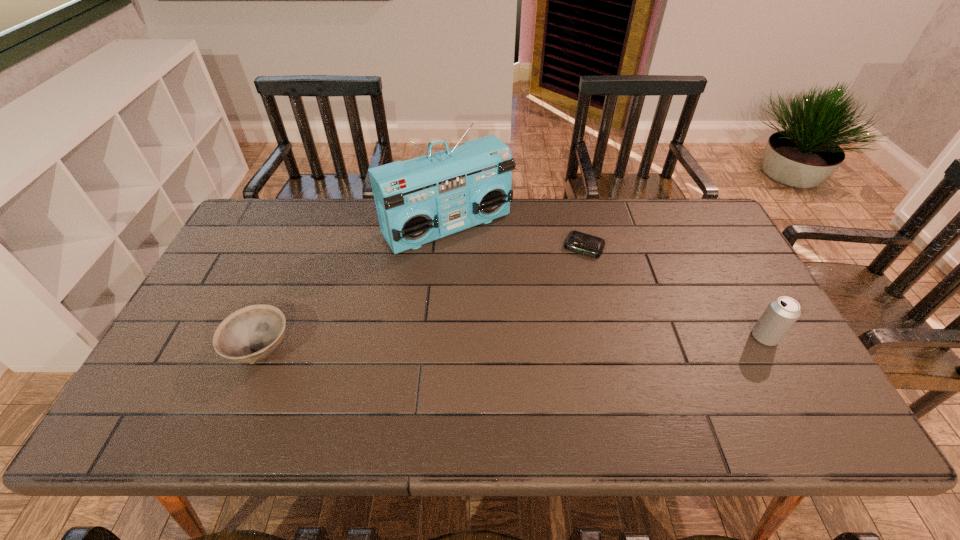
The width and height of the screenshot is (960, 540). I want to click on vacant area between the second shortest object and the third shortest object, so click(513, 343).

The width and height of the screenshot is (960, 540). I want to click on empty space between the leftmost object and the third object from right to left, so click(354, 288).

Identify the location of vacant space in between the alarm clock and the rightmost object. (674, 292).

Image resolution: width=960 pixels, height=540 pixels. What are the coordinates of `blank region between the leftmost object and the rightmost object` in the screenshot? It's located at (513, 343).

This screenshot has width=960, height=540. In order to click on blank region between the rightmost object and the leftmost object in this screenshot , I will do `click(513, 343)`.

This screenshot has width=960, height=540. I want to click on vacant region between the radio receiver and the third object from left to right, so click(516, 237).

Where is `free point between the third object from left to right and the rightmost object`? free point between the third object from left to right and the rightmost object is located at coordinates (674, 292).

Select which object is the third closest to the rightmost object. Please provide its 2D coordinates. Your answer should be formatted as a tuple, i.e. [(x, y)], where the tuple contains the x and y coordinates of a point satisfying the conditions above.

[(251, 334)]

Locate an element on the screen. This screenshot has height=540, width=960. object that can be found as the second closest to the third object from left to right is located at coordinates (780, 315).

Locate an element on the screen. Image resolution: width=960 pixels, height=540 pixels. free space that satisfies the following two spatial constraints: 1. on the front side of the second tallest object; 2. on the left side of the tallest object is located at coordinates (439, 337).